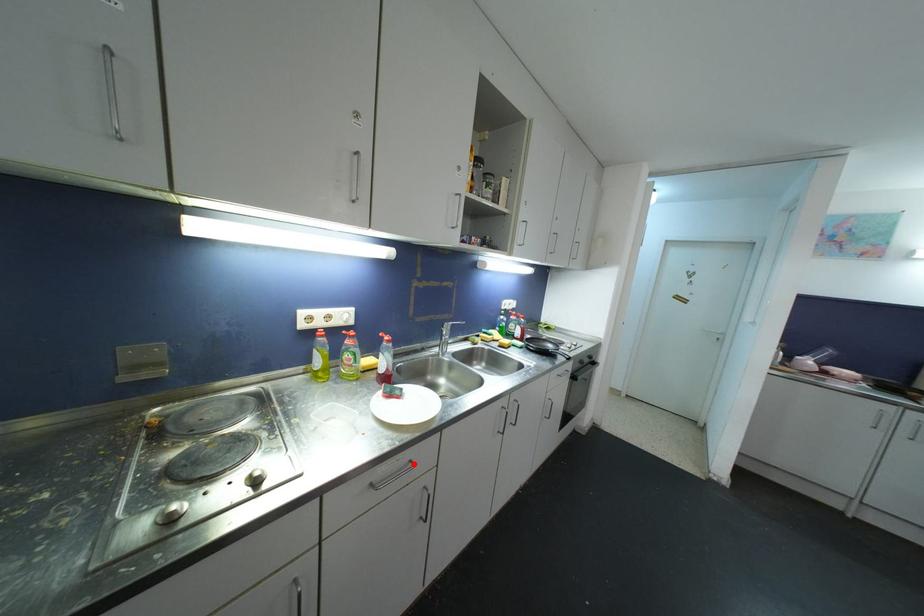
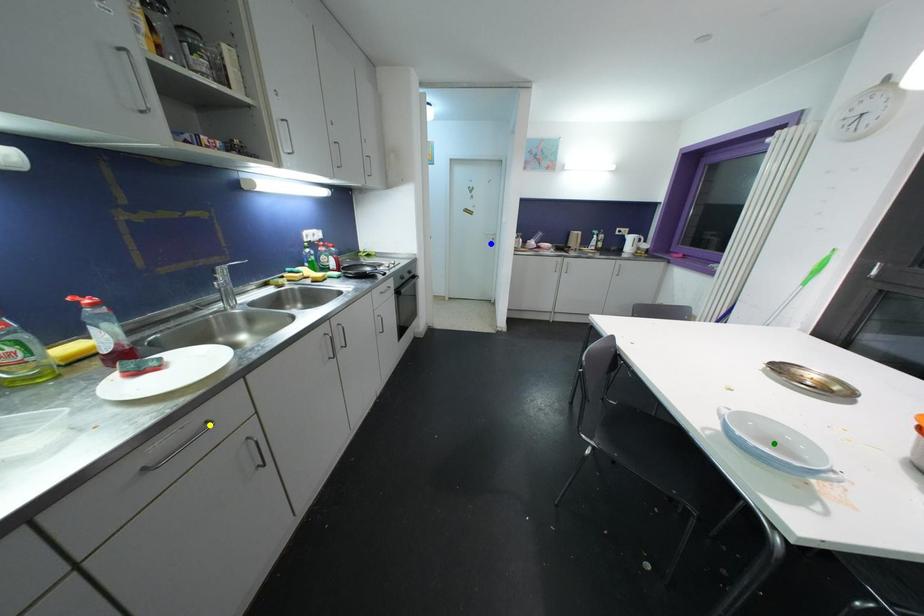
Question: I am providing you with two images of the same scene from different viewpoints. A red point is marked on the first image. You are given multiple points on the second image. Can you choose the point in image 2 that corresponds to the point in image 1?

Choices:
 (A) blue point
 (B) green point
 (C) yellow point

Answer: (C)